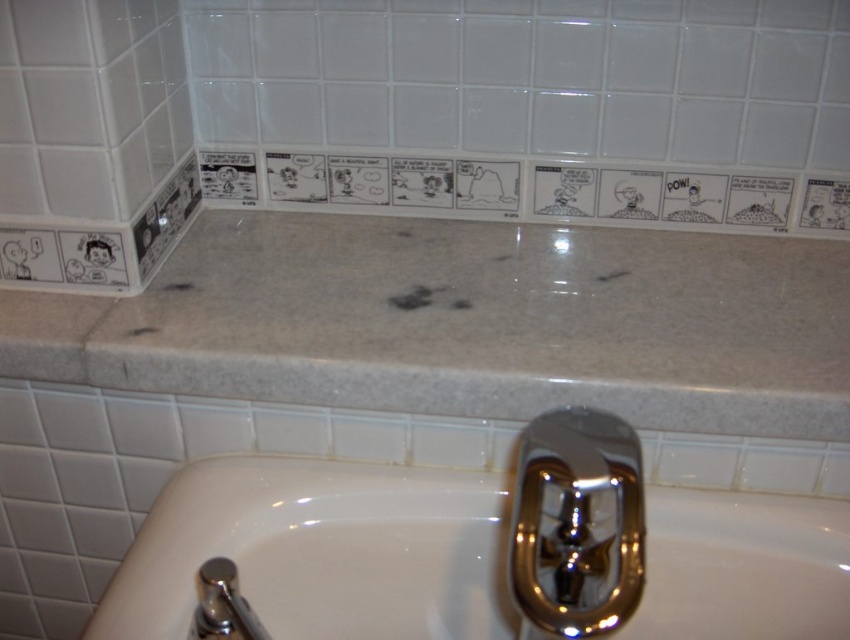
Question: Considering the relative positions of white marble counter top at upper center and polished chrome faucet at lower left in the image provided, where is white marble counter top at upper center located with respect to polished chrome faucet at lower left?

Choices:
 (A) below
 (B) above

Answer: (B)

Question: Does white marble counter top at upper center have a greater width compared to polished chrome faucet at lower center?

Choices:
 (A) yes
 (B) no

Answer: (A)

Question: Which of the following is the farthest from the observer?

Choices:
 (A) white marble counter top at upper center
 (B) polished chrome faucet at lower left
 (C) polished chrome faucet at lower center
 (D) white glossy bathtub at lower center

Answer: (A)

Question: Which point is farther to the camera?

Choices:
 (A) (218, 611)
 (B) (148, 536)
 (C) (446, 332)

Answer: (C)

Question: Does white marble counter top at upper center appear over polished chrome faucet at lower left?

Choices:
 (A) yes
 (B) no

Answer: (A)

Question: Which of the following is the closest to the observer?

Choices:
 (A) (207, 621)
 (B) (525, 480)

Answer: (B)